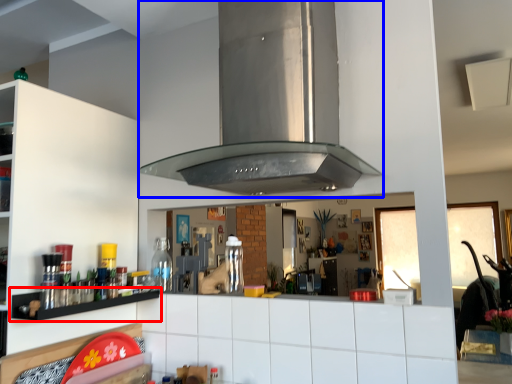
Question: Which point is further to the camera, shelf (highlighted by a red box) or vent (highlighted by a blue box)?

Choices:
 (A) shelf
 (B) vent

Answer: (A)